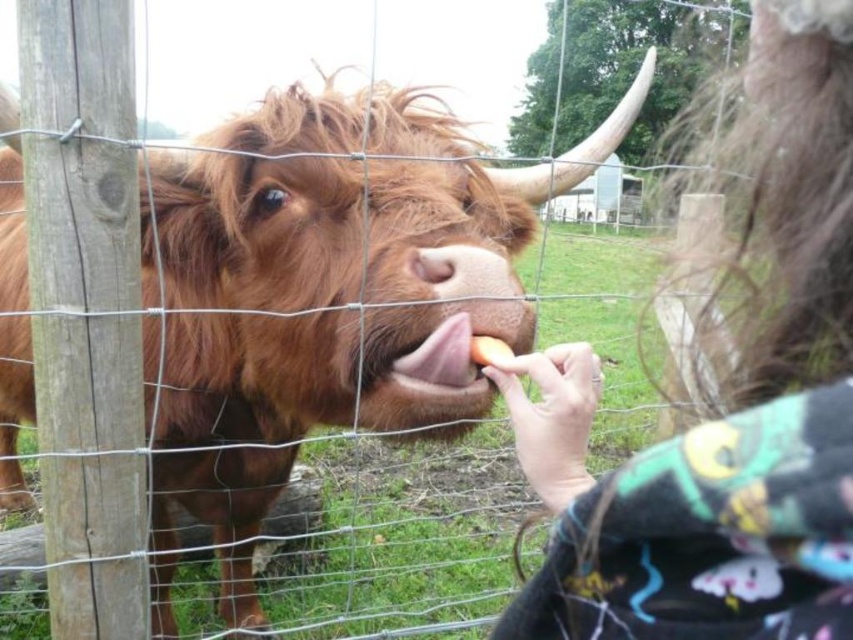
You are a photographer trying to capture the Highland cow in the image. To ensure the fluffy brown hair at upper right is in focus, where should you aim the camera? Please provide coordinates based on the image grid system where the bottom left corner is 0,0 and the top right is 1,1.

The fluffy brown hair at upper right is located at point (724, 417), so aim the camera at those coordinates to focus on it.

You are a photographer trying to capture a closeup shot of the yellow matte apple at center. You have a lens that can focus on objects within 12 inches. The fluffy brown hair at upper right might obstruct your shot. Is the hair close enough to interfere with your focus?

The distance between the fluffy brown hair at upper right and the yellow matte apple at center is 13.06 inches. Since your lens can only focus within 12 inches, the hair is slightly too far to interfere with the focus on the apple.

You are a farmer checking the fence between the brown fuzzy bison at center and the pink glossy tongue at center. The fence is 2 meters wide. Can the bison fit through the fence without bending?

The brown fuzzy bison at center is wider than the pink glossy tongue at center, but the description does not provide specific measurements for the bison or the fence opening. Therefore, it is unclear if the bison can fit through the 2 meter wide fence without bending.